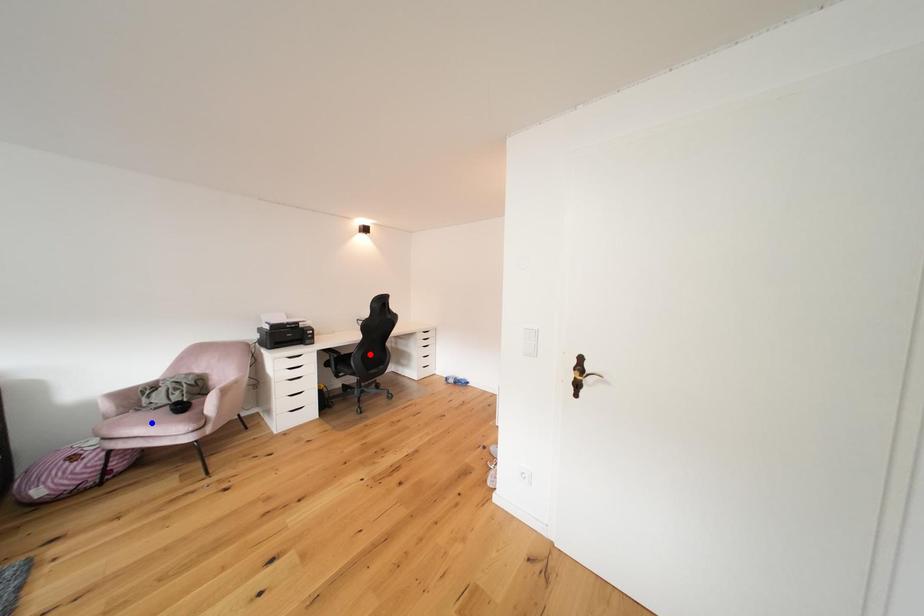
Question: Which of the two points in the image is closer to the camera?

Choices:
 (A) Blue point is closer.
 (B) Red point is closer.

Answer: (A)